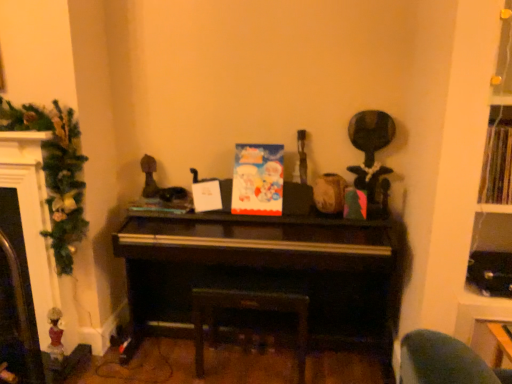
Measure the distance between point (136,203) and camera.

Point (136,203) and camera are 7.73 feet apart.

This screenshot has height=384, width=512. Describe the element at coordinates (497, 166) in the screenshot. I see `wooden book at upper right, the 1th book from the right` at that location.

Identify the location of matte black fireplace at left. This screenshot has height=384, width=512. point(32,217).

This screenshot has height=384, width=512. What are the coordinates of `dark wood stool at center` in the screenshot? It's located at (250, 309).

Measure the distance between dark wood piano at center and camera.

They are 6.29 feet apart.

This screenshot has height=384, width=512. I want to click on matte plastic book at center, placed as the 1th book when sorted from left to right, so click(163, 205).

Is wooden book at upper right, the second book in the back-to-front sequence, shorter than matte plastic book at center, placed as the 1th book when sorted from left to right?

Incorrect, the height of wooden book at upper right, the second book in the back-to-front sequence, does not fall short of that of matte plastic book at center, placed as the 1th book when sorted from left to right.

Where is `book below the wooden book at upper right, acting as the second book starting from the left (from a real-world perspective)`? This screenshot has width=512, height=384. book below the wooden book at upper right, acting as the second book starting from the left (from a real-world perspective) is located at coordinates (163, 205).

Between wooden book at upper right, the first book in the front-to-back sequence, and matte plastic book at center, placed as the 1th book when sorted from left to right, which one has smaller width?

With smaller width is wooden book at upper right, the first book in the front-to-back sequence.

From the image's perspective, is wooden book at upper right, the 1th book from the right, on top of matte plastic book at center, which is counted as the 2th book, starting from the front?

Yes, from the image's perspective, wooden book at upper right, the 1th book from the right, is on top of matte plastic book at center, which is counted as the 2th book, starting from the front.

Considering the relative sizes of matte paper card at center and green textured garland at left in the image provided, is matte paper card at center shorter than green textured garland at left?

Yes, matte paper card at center is shorter than green textured garland at left.

Which is in front, matte paper card at center or green textured garland at left?

Positioned in front is green textured garland at left.

Is matte paper card at center facing away from green textured garland at left?

That's not correct — matte paper card at center is not looking away from green textured garland at left.

Which is in front, point (281, 169) or point (70, 215)?

Positioned in front is point (70, 215).

Between point (59, 160) and point (42, 215), which one is positioned in front?

Point (59, 160)

Is green textured garland at left spatially inside matte black fireplace at left, or outside of it?

green textured garland at left exists outside the volume of matte black fireplace at left.

Is green textured garland at left in contact with matte black fireplace at left?

Yes, green textured garland at left is next to matte black fireplace at left.

Considering the sizes of green textured garland at left and matte black fireplace at left in the image, is green textured garland at left taller or shorter than matte black fireplace at left?

Considering their sizes, green textured garland at left has less height than matte black fireplace at left.

From a real-world perspective, is matte plastic book at center, placed as the 1th book when sorted from left to right, located higher than green textured garland at left?

No, from a real-world perspective, matte plastic book at center, placed as the 1th book when sorted from left to right, is not above green textured garland at left.

Between matte plastic book at center, marked as the 1th book in a back-to-front arrangement, and green textured garland at left, which one has larger width?

matte plastic book at center, marked as the 1th book in a back-to-front arrangement, is wider.

Is matte plastic book at center, placed as the 1th book when sorted from left to right, directly adjacent to green textured garland at left?

matte plastic book at center, placed as the 1th book when sorted from left to right, and green textured garland at left are clearly separated.

Which object is positioned more to the left, matte plastic book at center, which is counted as the 2th book, starting from the front, or green textured garland at left?

green textured garland at left.

Considering the positions of point (256, 186) and point (233, 305), is point (256, 186) closer or farther from the camera than point (233, 305)?

Point (256, 186) is positioned farther from the camera compared to point (233, 305).

From the image's perspective, is matte paper card at center on top of dark wood stool at center?

Yes, from the image's perspective, matte paper card at center is above dark wood stool at center.

Which is more to the left, matte paper card at center or dark wood stool at center?

dark wood stool at center.

Is dark wood stool at center surrounded by matte paper card at center?

No.

Is there a large distance between dark wood stool at center and matte black fireplace at left?

They are positioned close to each other.

Between dark wood stool at center and matte black fireplace at left, which one is positioned behind?

dark wood stool at center.

From the picture: Looking at their sizes, would you say dark wood stool at center is wider or thinner than matte black fireplace at left?

dark wood stool at center is wider than matte black fireplace at left.

Is point (298, 295) closer to viewer compared to point (38, 216)?

That is False.

Identify the location of fireplace that is below the wooden book at upper right, the second book in the back-to-front sequence (from the image's perspective). This screenshot has width=512, height=384. (32, 217).

From the image's perspective, would you say wooden book at upper right, the first book in the front-to-back sequence, is positioned over matte black fireplace at left?

Correct, wooden book at upper right, the first book in the front-to-back sequence, appears higher than matte black fireplace at left in the image.

From a real-world perspective, is wooden book at upper right, the 1th book from the right, over matte black fireplace at left?

Yes, from a real-world perspective, wooden book at upper right, the 1th book from the right, is over matte black fireplace at left

Which of these two, wooden book at upper right, acting as the second book starting from the left, or matte black fireplace at left, is smaller?

With smaller size is wooden book at upper right, acting as the second book starting from the left.

I want to click on book behind the wooden book at upper right, the first book in the front-to-back sequence, so click(163, 205).

What are the coordinates of `christmas card above the green textured garland at left (from a real-world perspective)` in the screenshot? It's located at (257, 180).

When comparing their distances from green textured garland at left, does dark wood stool at center or wooden book at upper right, the 1th book from the right, seem further?

wooden book at upper right, the 1th book from the right, is further to green textured garland at left.

From the image, which object appears to be nearer to wooden book at upper right, the first book in the front-to-back sequence, matte paper card at center or dark wood piano at center?

The object closer to wooden book at upper right, the first book in the front-to-back sequence, is dark wood piano at center.

Looking at the image, which one is located closer to wooden book at upper right, the first book in the front-to-back sequence, matte paper card at center or dark wood stool at center?

matte paper card at center is positioned closer to the anchor wooden book at upper right, the first book in the front-to-back sequence.

Based on their spatial positions, is wooden book at upper right, acting as the second book starting from the left, or green textured garland at left closer to dark wood stool at center?

green textured garland at left.

When comparing their distances from dark wood piano at center, does green textured garland at left or wooden book at upper right, acting as the second book starting from the left, seem further?

green textured garland at left is further to dark wood piano at center.

Looking at the image, which one is located further to matte black fireplace at left, wooden book at upper right, the first book in the front-to-back sequence, or dark wood stool at center?

wooden book at upper right, the first book in the front-to-back sequence, is positioned further to the anchor matte black fireplace at left.

From the image, which object appears to be nearer to matte black fireplace at left, green textured garland at left or dark wood stool at center?

green textured garland at left.

From the image, which object appears to be nearer to dark wood stool at center, matte plastic book at center, which is the 2th book from right to left, or matte black fireplace at left?

The object closer to dark wood stool at center is matte plastic book at center, which is the 2th book from right to left.

Where is `furniture between green textured garland at left and wooden book at upper right, the second book in the back-to-front sequence, from left to right`? Image resolution: width=512 pixels, height=384 pixels. furniture between green textured garland at left and wooden book at upper right, the second book in the back-to-front sequence, from left to right is located at coordinates (250, 309).

Locate an element on the screen. The height and width of the screenshot is (384, 512). book between matte paper card at center and dark wood stool at center from top to bottom is located at coordinates (163, 205).

Locate an element on the screen. The width and height of the screenshot is (512, 384). book located between green textured garland at left and wooden book at upper right, the first book in the front-to-back sequence, in the left-right direction is located at coordinates (163, 205).

The image size is (512, 384). Find the location of `christmas card between dark wood piano at center and wooden book at upper right, the second book in the back-to-front sequence, in the horizontal direction`. christmas card between dark wood piano at center and wooden book at upper right, the second book in the back-to-front sequence, in the horizontal direction is located at coordinates (257, 180).